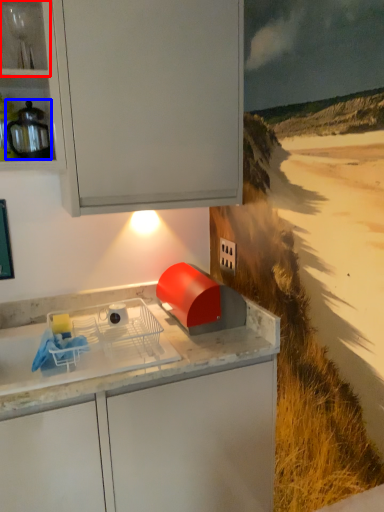
Question: Which of the following is the closest to the observer, shelf (highlighted by a red box) or kitchen appliance (highlighted by a blue box)?

Choices:
 (A) shelf
 (B) kitchen appliance

Answer: (A)